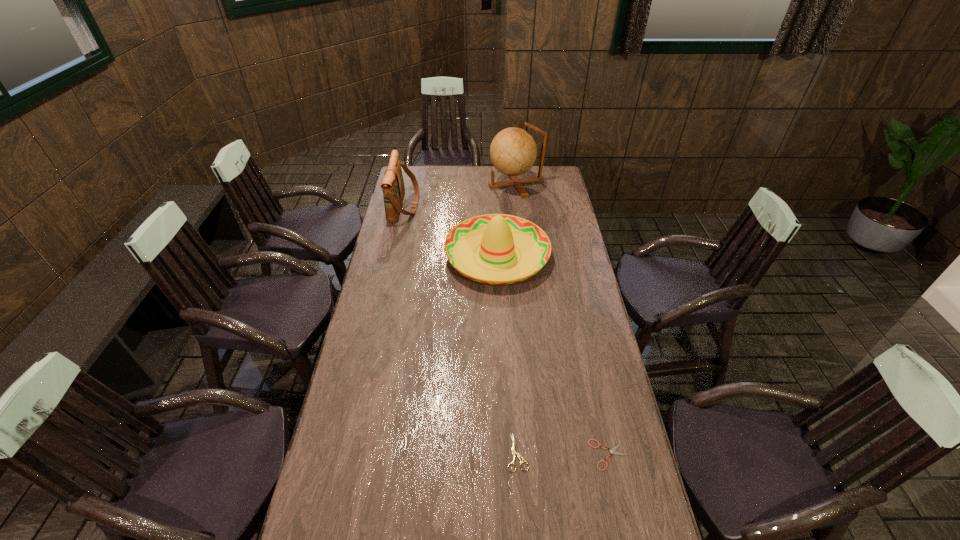
Locate an element on the screen. free space between the right shears and the sombrero is located at coordinates (553, 355).

This screenshot has width=960, height=540. I want to click on free space between the sombrero and the leftmost object, so click(x=451, y=230).

In order to click on empty space that is in between the globe and the shoulder bag in this screenshot , I will do click(x=460, y=194).

Point out which object is positioned as the second nearest to the left shears. Please provide its 2D coordinates. Your answer should be formatted as a tuple, i.e. [(x, y)], where the tuple contains the x and y coordinates of a point satisfying the conditions above.

[(501, 237)]

Identify which object is the fourth closest to the taller shears. Please provide its 2D coordinates. Your answer should be formatted as a tuple, i.e. [(x, y)], where the tuple contains the x and y coordinates of a point satisfying the conditions above.

[(513, 151)]

You are a GUI agent. You are given a task and a screenshot of the screen. Output one action in this format:
    pyautogui.click(x=<x>, y=<y>)
    Task: Click on the free space that satisfies the following two spatial constraints: 1. on the front-facing side of the shoulder bag; 2. on the back side of the sombrero
    This screenshot has height=540, width=960.
    Given the screenshot: What is the action you would take?
    pyautogui.click(x=394, y=255)

Find the location of a particular element. vacant space that satisfies the following two spatial constraints: 1. on the front-facing side of the sombrero; 2. on the right side of the shoulder bag is located at coordinates (394, 255).

Locate an element on the screen. free space that satisfies the following two spatial constraints: 1. on the front-facing side of the leftmost object; 2. on the back side of the sombrero is located at coordinates (394, 255).

Locate an element on the screen. This screenshot has height=540, width=960. free space that satisfies the following two spatial constraints: 1. on the surface of the shortest object; 2. on the right side of the tallest object is located at coordinates (547, 455).

The height and width of the screenshot is (540, 960). I want to click on free spot that satisfies the following two spatial constraints: 1. on the front side of the shortest object; 2. on the right side of the taller shears, so click(517, 455).